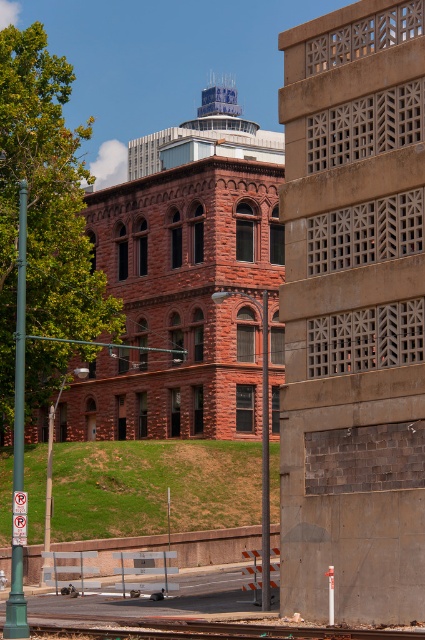
Consider the image. Can you confirm if brown textured wall at center right is smaller than smooth concrete train track at lower center?

Incorrect, brown textured wall at center right is not smaller in size than smooth concrete train track at lower center.

Is point (368, 440) farther from camera compared to point (104, 636)?

That is True.

You are a GUI agent. You are given a task and a screenshot of the screen. Output one action in this format:
    pyautogui.click(x=<x>, y=<y>)
    Task: Click on the brown textured wall at center right
    
    Given the screenshot: What is the action you would take?
    pyautogui.click(x=354, y=312)